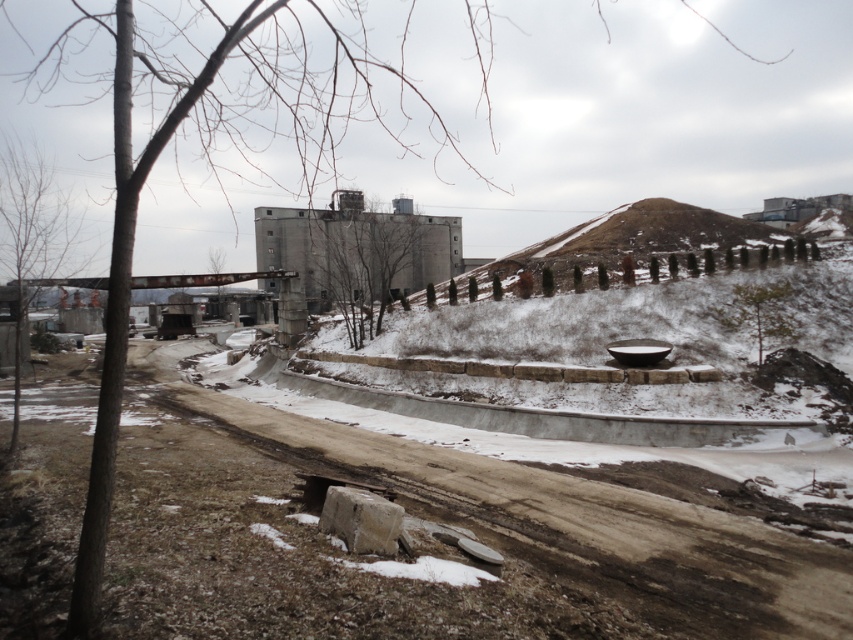
Who is higher up, brown dirt track at center or bare wood tree at left?

bare wood tree at left is above.

Who is more distant from viewer, (x=509, y=550) or (x=57, y=227)?

Point (x=57, y=227)

Which is behind, point (503, 540) or point (4, 170)?

The point (4, 170) is behind.

The height and width of the screenshot is (640, 853). Identify the location of brown dirt track at center. (567, 522).

Does bare branches at center lie behind bare wood tree at left?

Yes.

Who is more distant from viewer, [410,288] or [22,252]?

The point [410,288] is behind.

Find the location of a particular element. This screenshot has height=640, width=853. bare branches at center is located at coordinates pos(373,259).

Find the location of a particular element. The height and width of the screenshot is (640, 853). bare branches at center is located at coordinates (373, 259).

This screenshot has height=640, width=853. What do you see at coordinates (567, 522) in the screenshot?
I see `brown dirt track at center` at bounding box center [567, 522].

Image resolution: width=853 pixels, height=640 pixels. Identify the location of brown dirt track at center. (567, 522).